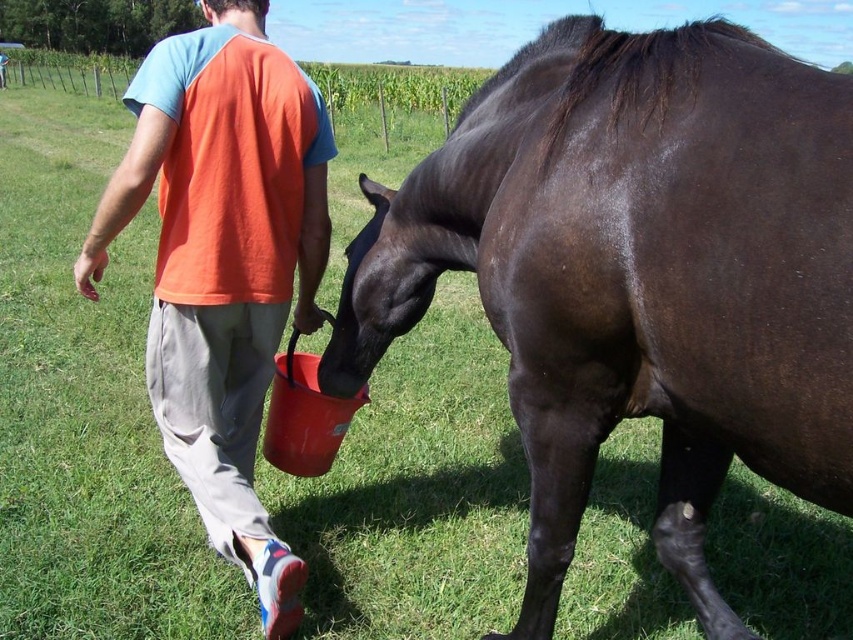
You are a GUI agent. You are given a task and a screenshot of the screen. Output one action in this format:
    pyautogui.click(x=<x>, y=<y>)
    Task: Click on the shiny dark brown horse at center
    
    Given the screenshot: What is the action you would take?
    pyautogui.click(x=637, y=275)

Is shiny dark brown horse at center below orange cotton t-shirt at center?

Correct, shiny dark brown horse at center is located below orange cotton t-shirt at center.

Locate an element on the screen. The width and height of the screenshot is (853, 640). shiny dark brown horse at center is located at coordinates (637, 275).